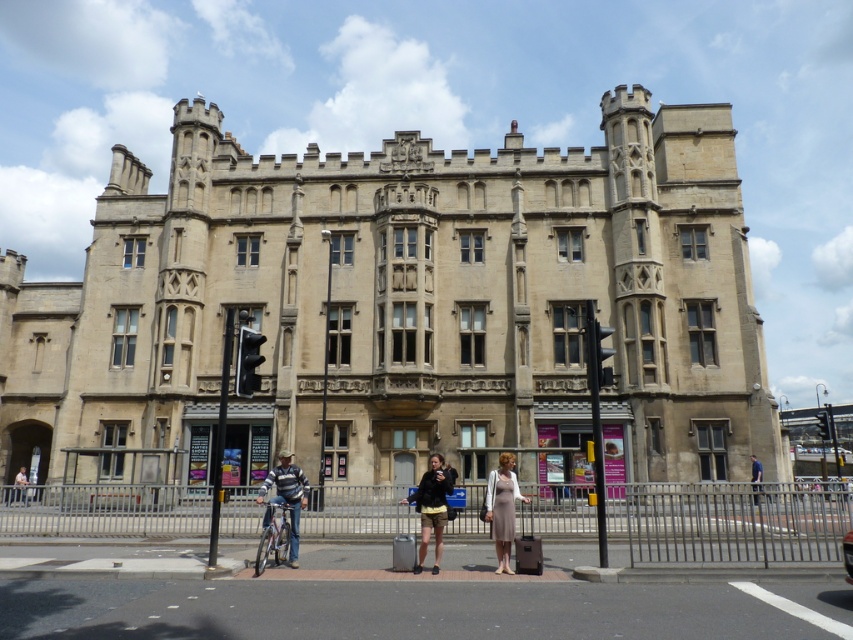
You are a photographer taking a photo of the historic building and the people in front of it. You notice the dark brown leather jacket at center and the light beige dress at center. Which clothing item is shorter in length?

The dark brown leather jacket at center is shorter than the light beige dress at center.

You are a fashion designer observing the scene in front of the historic building. You notice two people wearing the dark brown leather jacket at center and the striped sweater at center. Which clothing item is taller?

The dark brown leather jacket at center is much taller than the striped sweater at center.